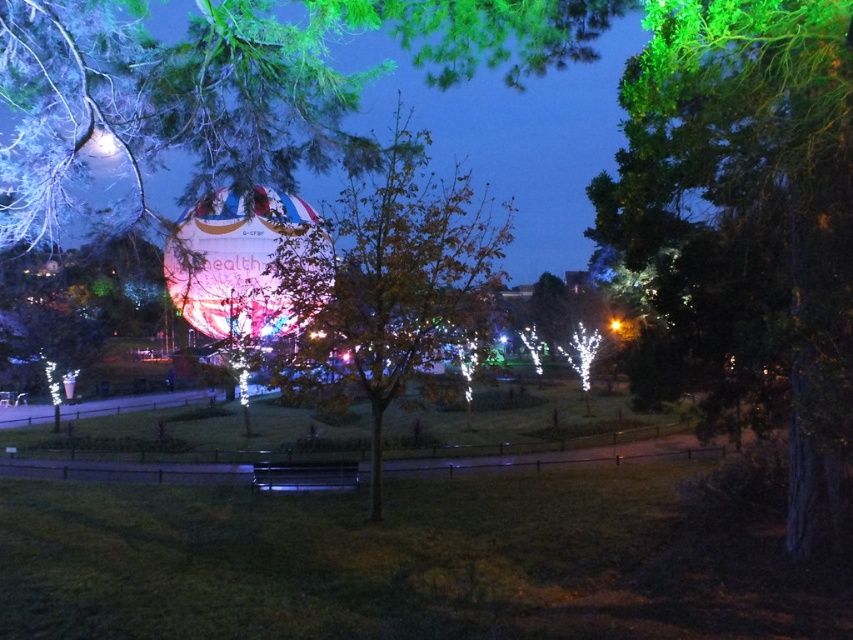
Which is below, orange leafy tree at center or metallic silver bench at center?

metallic silver bench at center is below.

Is point (380, 499) positioned behind point (311, 486)?

No, it is not.

Where is `orange leafy tree at center`? orange leafy tree at center is located at coordinates (387, 282).

Is green leafy tree at right taller than orange leafy tree at center?

In fact, green leafy tree at right may be shorter than orange leafy tree at center.

This screenshot has height=640, width=853. Describe the element at coordinates (747, 224) in the screenshot. I see `green leafy tree at right` at that location.

Identify the location of green leafy tree at right. (747, 224).

Image resolution: width=853 pixels, height=640 pixels. What are the coordinates of `green leafy tree at right` in the screenshot? It's located at (747, 224).

Can you confirm if green leafy tree at right is thinner than metallic silver bench at center?

No, green leafy tree at right is not thinner than metallic silver bench at center.

Is point (663, 310) behind point (276, 470)?

No.

The image size is (853, 640). Identify the location of green leafy tree at right. (747, 224).